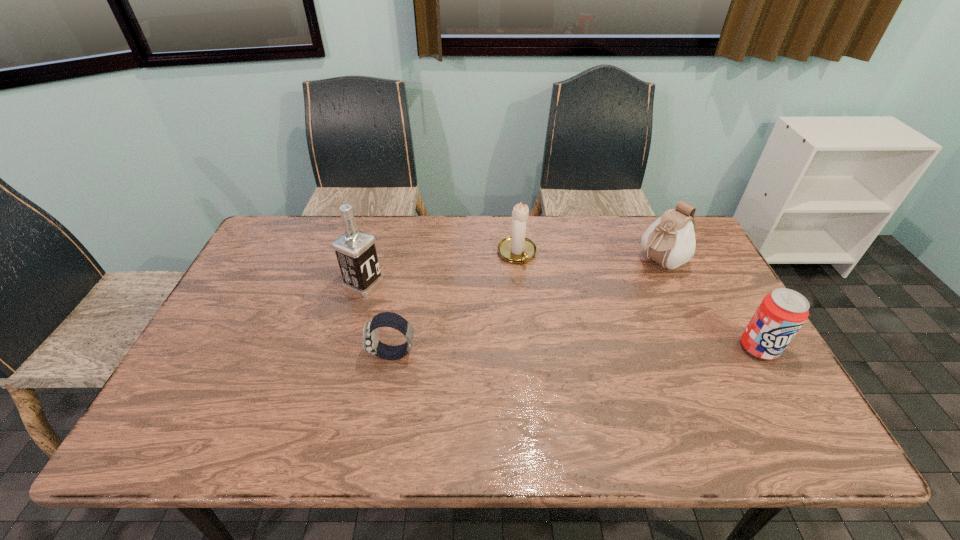
At what (x,y) coordinates should I click in order to perform the action: click on vacant point located between the candle holder and the soda can. Please return your answer as a coordinate pair (x, y). The width and height of the screenshot is (960, 540). Looking at the image, I should click on (638, 301).

Locate an element on the screen. free space between the soda can and the shortest object is located at coordinates (576, 351).

Image resolution: width=960 pixels, height=540 pixels. I want to click on empty location between the fourth object from left to right and the vodka, so click(x=512, y=273).

Locate an element on the screen. The image size is (960, 540). vacant space in between the shortest object and the fourth object from left to right is located at coordinates (526, 308).

In order to click on empty space between the vodka and the fourth object from left to right in this screenshot , I will do `click(512, 273)`.

Identify the location of empty space that is in between the third object from left to right and the pouch. This screenshot has width=960, height=540. (588, 258).

This screenshot has width=960, height=540. What are the coordinates of `free space that is in between the vodka and the soda can` in the screenshot? It's located at (562, 316).

The image size is (960, 540). What are the coordinates of `free spot between the third object from left to right and the fourth object from right to left` in the screenshot? It's located at pyautogui.click(x=455, y=305).

The width and height of the screenshot is (960, 540). Identify the location of vacant space that's between the soda can and the candle holder. (638, 301).

Image resolution: width=960 pixels, height=540 pixels. Identify the location of object that ranks as the second closest to the shortest object. (517, 248).